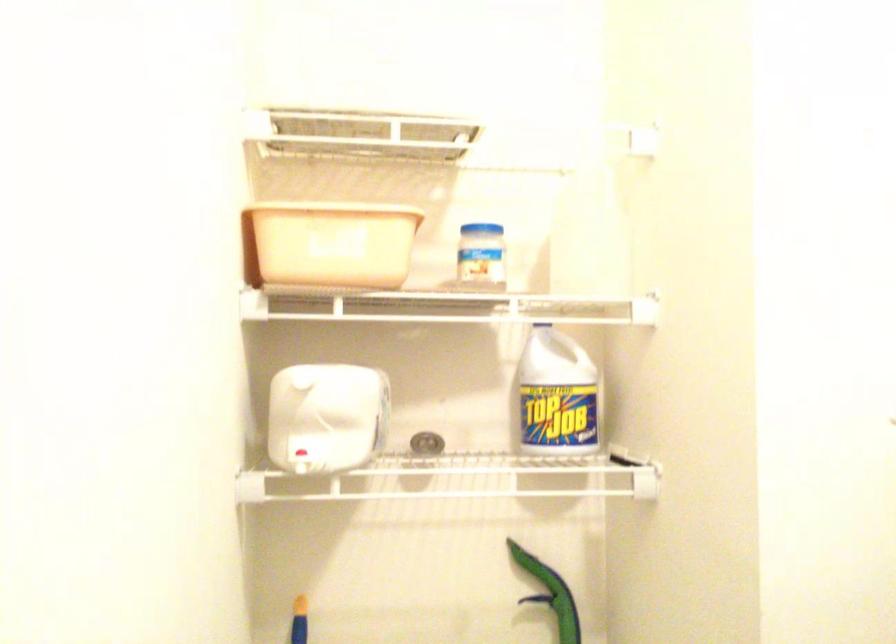
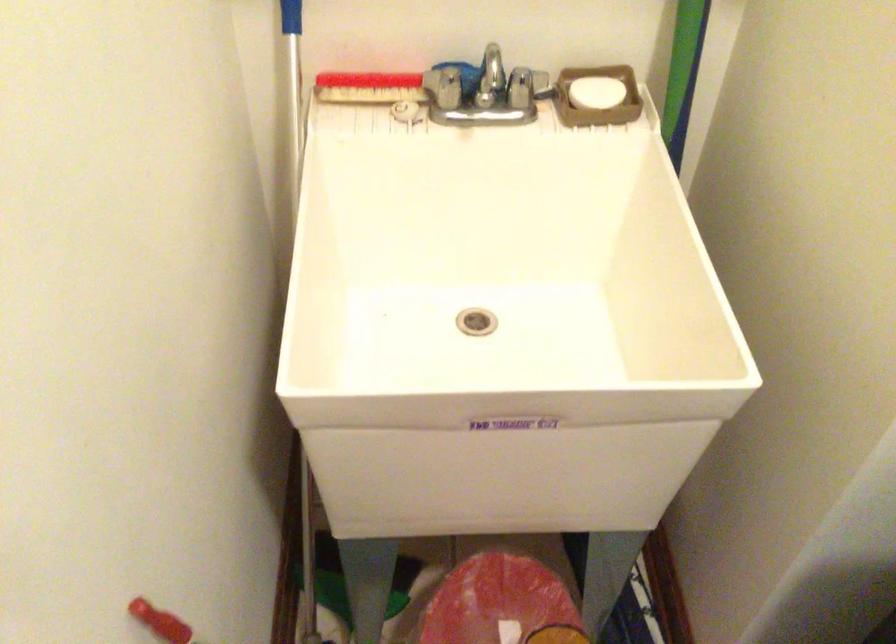
Question: The first image is from the beginning of the video and the second image is from the end. How did the camera likely rotate when shooting the video?

Choices:
 (A) Left
 (B) Right
 (C) Up
 (D) Down

Answer: (D)